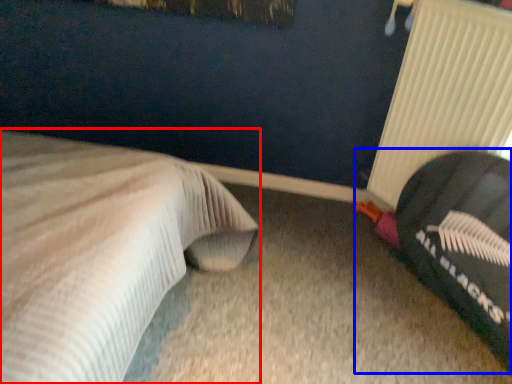
Question: Which of the following is the farthest to the observer, bed (highlighted by a red box) or bean bag chair (highlighted by a blue box)?

Choices:
 (A) bed
 (B) bean bag chair

Answer: (B)